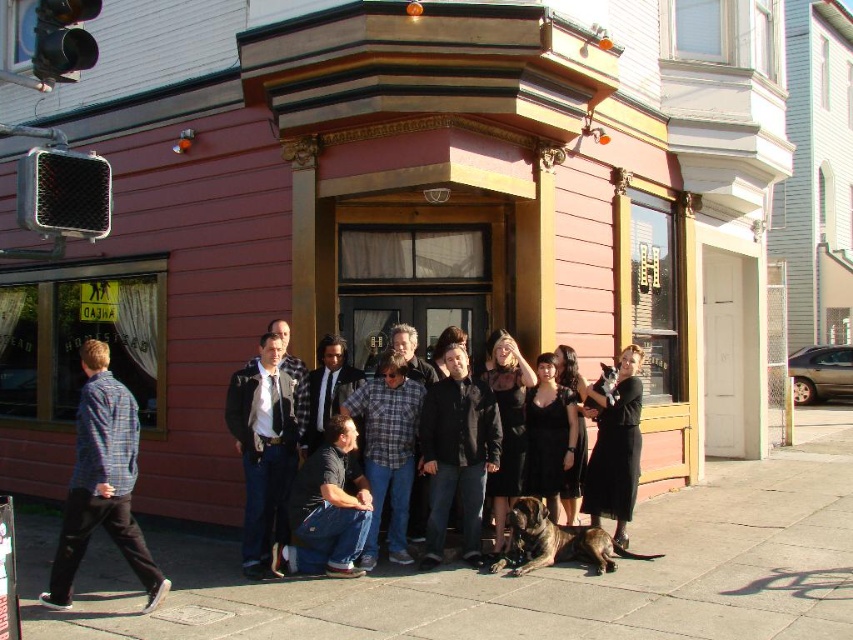
Does dark gray jacket at center lie behind black dress at center?

No, dark gray jacket at center is closer to the viewer.

Who is higher up, dark gray jacket at center or black dress at center?

dark gray jacket at center is above.

Which is behind, point (440, 435) or point (601, 413)?

Positioned behind is point (601, 413).

Image resolution: width=853 pixels, height=640 pixels. What are the coordinates of `dark gray jacket at center` in the screenshot? It's located at [x=457, y=452].

Who is higher up, concrete sidewalk at center or matte black jacket at center?

Positioned higher is matte black jacket at center.

Measure the distance between concrete sidewalk at center and matte black jacket at center.

The distance of concrete sidewalk at center from matte black jacket at center is 5.89 feet.

Between point (815, 436) and point (259, 374), which one is positioned behind?

Point (815, 436)

The height and width of the screenshot is (640, 853). Find the location of `concrete sidewalk at center`. concrete sidewalk at center is located at coordinates (524, 576).

Between point (811, 616) and point (337, 422), which one is positioned in front?

Positioned in front is point (811, 616).

Is concrete sidewalk at center further to the viewer compared to denim jeans at center?

That is False.

Where is `concrete sidewalk at center`? The height and width of the screenshot is (640, 853). concrete sidewalk at center is located at coordinates (524, 576).